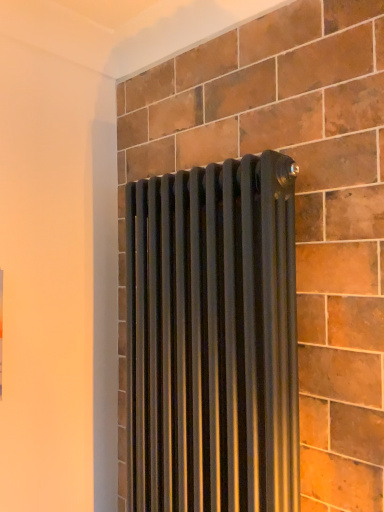
At what (x,y) coordinates should I click in order to perform the action: click on matte black radiator at center. Please return your answer as a coordinate pair (x, y). The width and height of the screenshot is (384, 512). Looking at the image, I should click on (213, 339).

This screenshot has width=384, height=512. Describe the element at coordinates (213, 339) in the screenshot. I see `matte black radiator at center` at that location.

Locate an element on the screen. This screenshot has width=384, height=512. matte black radiator at center is located at coordinates (213, 339).